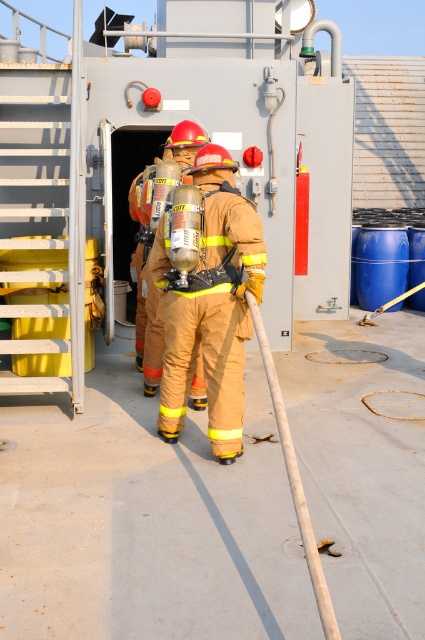
You are a firefighter on the ship deck and need to reach the point marked as point [227,216]. Can you estimate how far you need to walk to get there?

The distance between you and point [227,216] is 4.32 meters, so you need to walk approximately 4.32 meters to reach it.